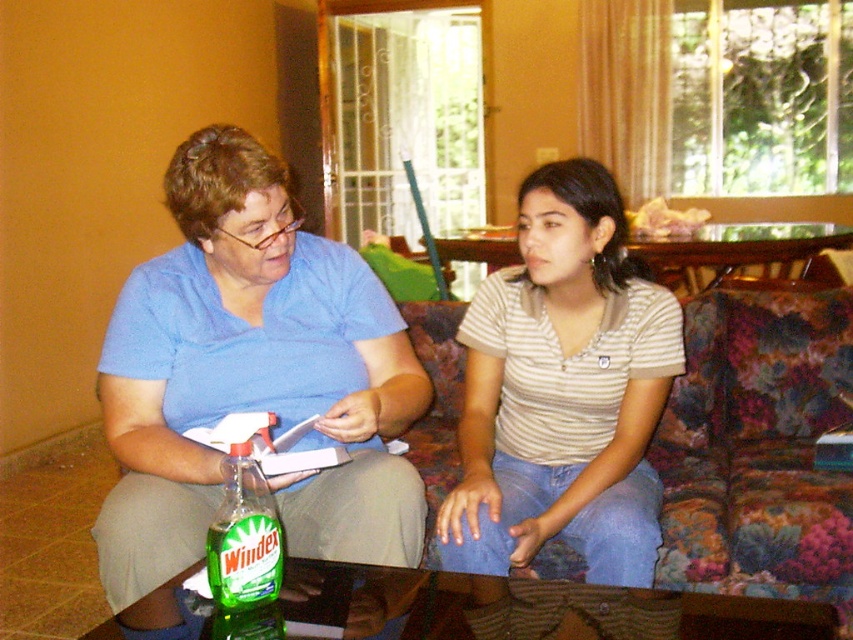
You are a delivery person who just arrived at the apartment. You need to place a package that is 24 inches long on the table between the striped cotton shirt at center and the green glass windex at lower left. Will the package fit between them?

The distance between the striped cotton shirt at center and the green glass windex at lower left is 23.97 inches. Since the package is 24 inches long, it will not fit between them as the space is slightly shorter than the package.

You are a housekeeper who needs to clean a window. You see the green matte windex at left and the green glass windex at lower left. Which one is closer to you?

The green glass windex at lower left is behind the green matte windex at left, so the green matte windex at left is closer to you.